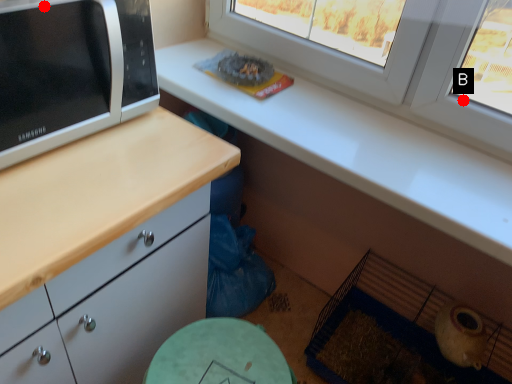
Question: Two points are circled on the image, labeled by A and B beside each circle. Among these points, which one is nearest to the camera?

Choices:
 (A) A is closer
 (B) B is closer

Answer: (A)